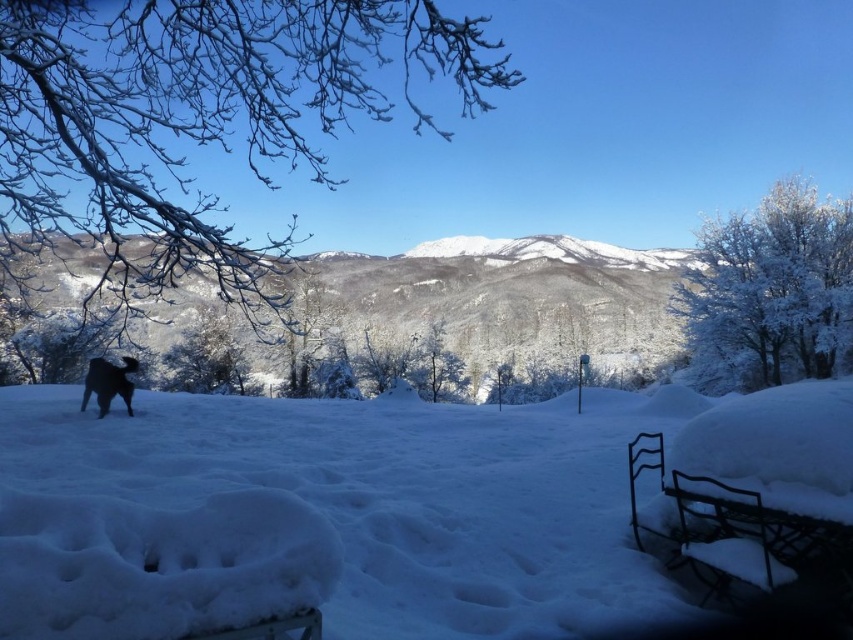
Is white fluffy snow at lower left to the left of snow-covered mountain at center from the viewer's perspective?

Incorrect, white fluffy snow at lower left is not on the left side of snow-covered mountain at center.

Does white fluffy snow at lower left have a lesser width compared to snow-covered mountain at center?

Yes, white fluffy snow at lower left is thinner than snow-covered mountain at center.

In order to click on white fluffy snow at lower left in this screenshot , I will do `click(376, 502)`.

The width and height of the screenshot is (853, 640). I want to click on white fluffy snow at lower left, so click(376, 502).

Between point (556, 273) and point (84, 394), which one is positioned in front?

Point (84, 394)

The width and height of the screenshot is (853, 640). I want to click on snow-covered mountain at center, so click(509, 298).

The height and width of the screenshot is (640, 853). In order to click on white fluffy snow at lower left in this screenshot , I will do `click(376, 502)`.